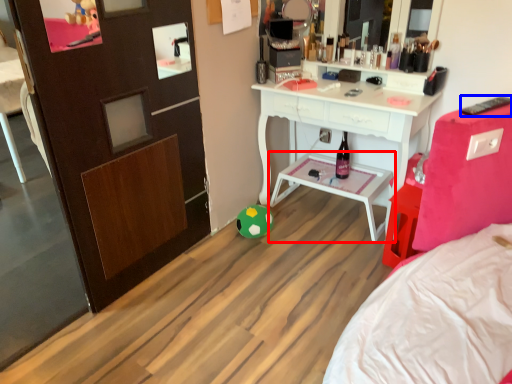
Question: Which object is closer to the camera taking this photo, table (highlighted by a red box) or remote control (highlighted by a blue box)?

Choices:
 (A) table
 (B) remote control

Answer: (B)